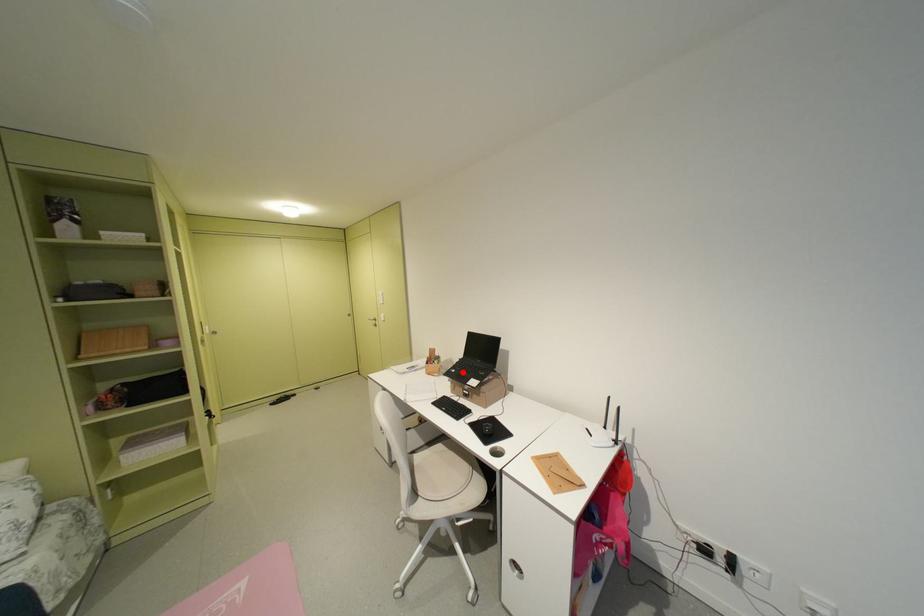
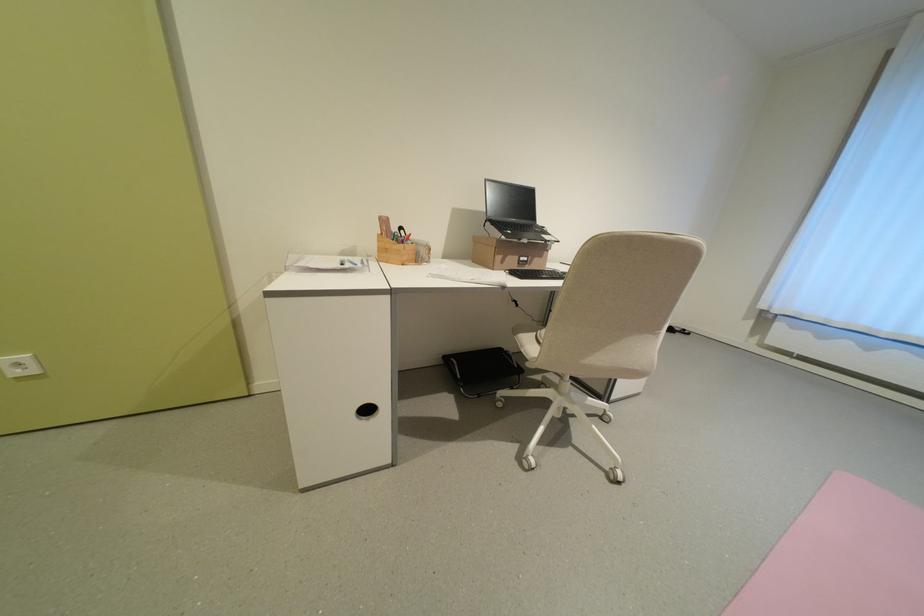
In the second image, find the point that corresponds to the highlighted location in the first image.

(518, 233)